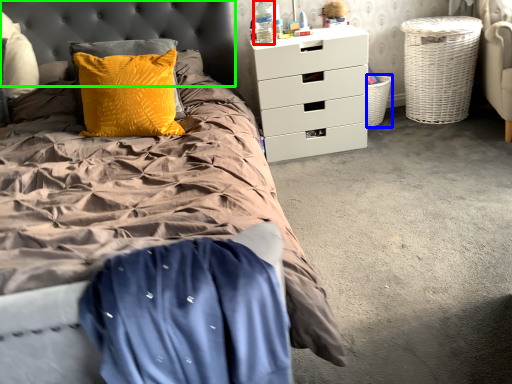
Question: Considering the real-world distances, which object is closest to bottle (highlighted by a red box)? basket (highlighted by a blue box) or headboard (highlighted by a green box).

Choices:
 (A) basket
 (B) headboard

Answer: (B)